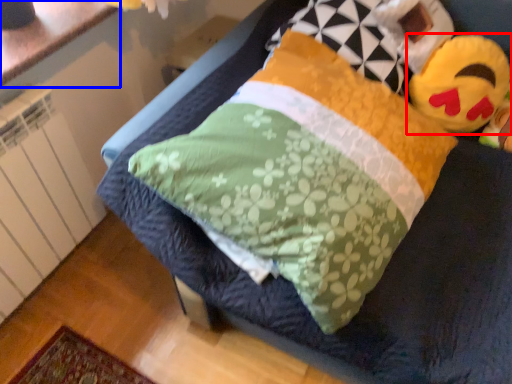
Question: Which of the following is the farthest to the observer, toy (highlighted by a red box) or counter top (highlighted by a blue box)?

Choices:
 (A) toy
 (B) counter top

Answer: (A)